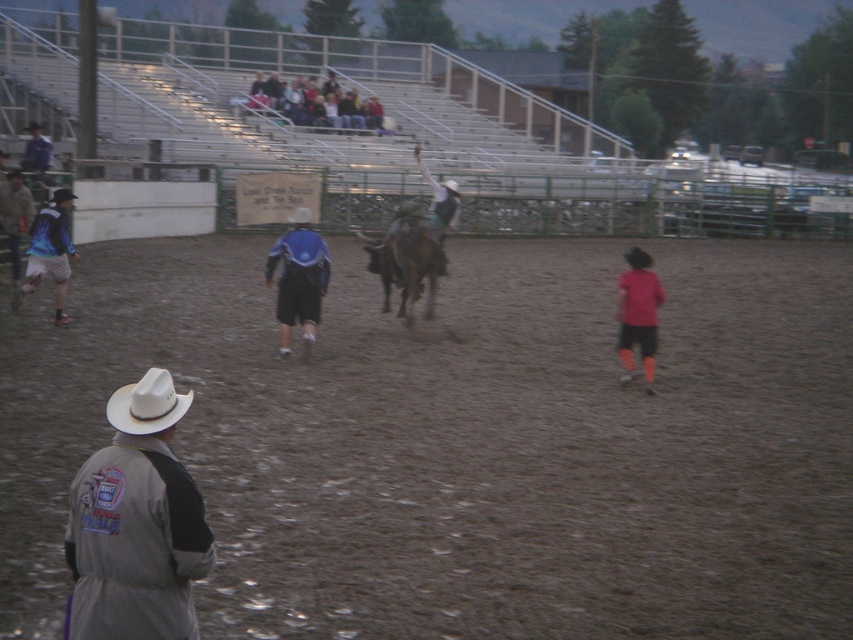
You are a photographer at the rodeo event. You want to take a photo that includes both the light gray fabric jacket at lower left and the red matte shirt at right. Based on their positions, which object should you focus on first to ensure both are in frame?

The light gray fabric jacket at lower left is below the red matte shirt at right, so you should focus on the red matte shirt at right first to ensure both are in frame.

You are a photographer at the rodeo event. You want to capture a photo that includes both the light gray fabric jacket at lower left and the red matte shirt at right. Which object should you focus on first to ensure both are in frame?

You should focus on the light gray fabric jacket at lower left first because it is larger in size than the red matte shirt at right, making it easier to frame both objects in the photo.